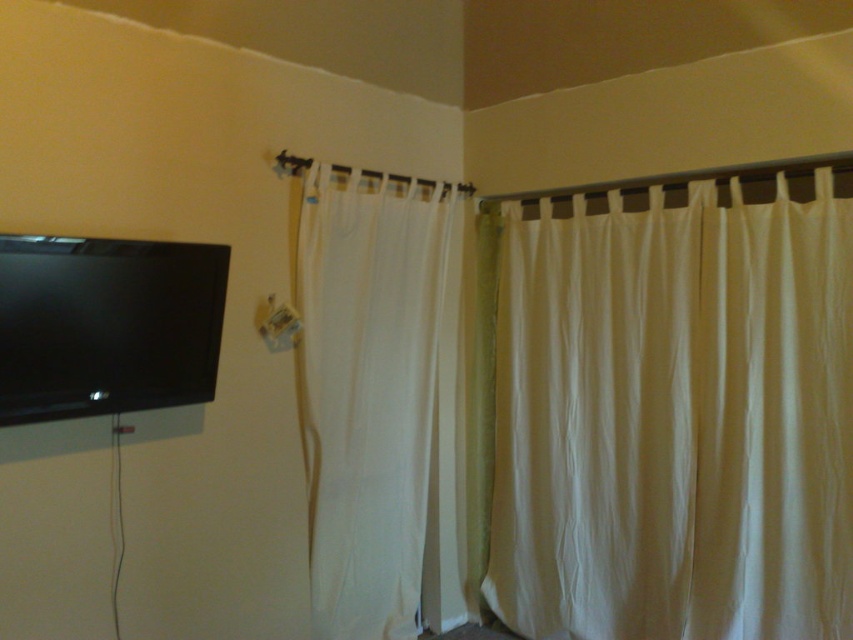
Question: Which of these objects is positioned closest to the white sheer curtain at upper right?

Choices:
 (A) black glossy flat screen tv at upper left
 (B) white sheer curtain at center

Answer: (B)

Question: Is white sheer curtain at upper right below black glossy flat screen tv at upper left?

Choices:
 (A) no
 (B) yes

Answer: (B)

Question: Based on their relative distances, which object is nearer to the white sheer curtain at center?

Choices:
 (A) black glossy flat screen tv at upper left
 (B) white sheer curtain at upper right

Answer: (B)

Question: Based on their relative distances, which object is nearer to the black glossy flat screen tv at upper left?

Choices:
 (A) white sheer curtain at center
 (B) white sheer curtain at upper right

Answer: (A)

Question: Is white sheer curtain at center thinner than black glossy flat screen tv at upper left?

Choices:
 (A) yes
 (B) no

Answer: (B)

Question: Is white sheer curtain at upper right to the right of black glossy flat screen tv at upper left from the viewer's perspective?

Choices:
 (A) yes
 (B) no

Answer: (A)